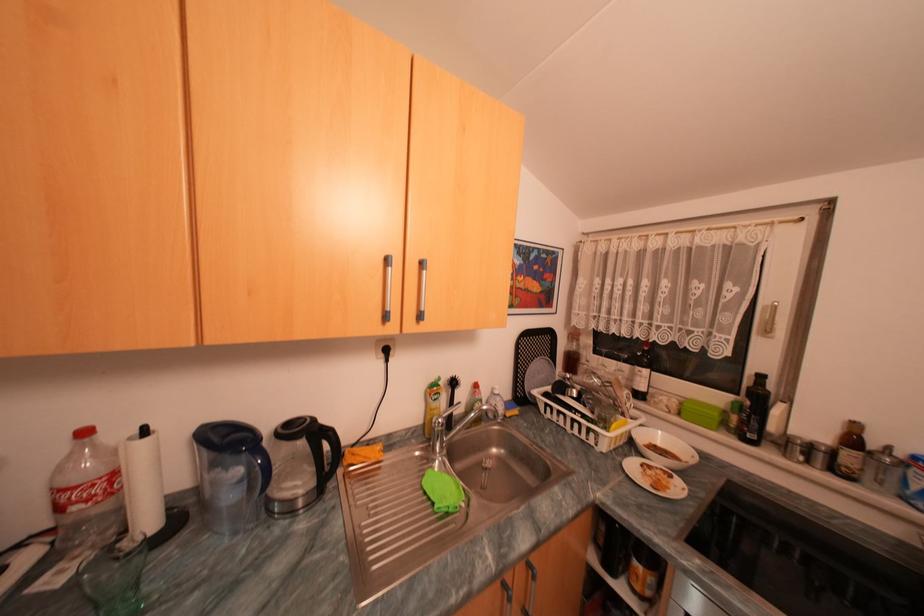
Which object does [641,373] point to?

It refers to a wine bottle.